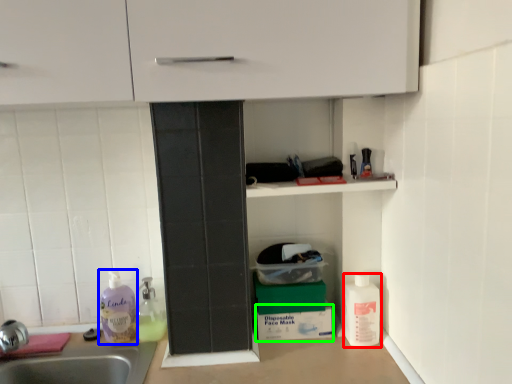
Question: Based on their relative distances, which object is farther from cleaning product (highlighted by a red box)? Choose from cleaning product (highlighted by a blue box) and cardboard box (highlighted by a green box).

Choices:
 (A) cleaning product
 (B) cardboard box

Answer: (A)